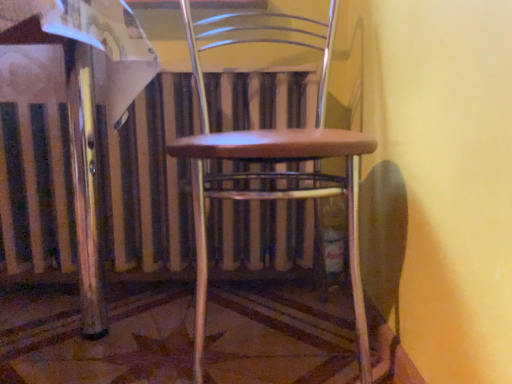
The image size is (512, 384). Identify the location of wooden seat at center. (272, 161).

This screenshot has height=384, width=512. Describe the element at coordinates (272, 161) in the screenshot. I see `wooden seat at center` at that location.

This screenshot has height=384, width=512. What do you see at coordinates (150, 181) in the screenshot?
I see `metallic silver radiator at center` at bounding box center [150, 181].

Find the location of a particular element. metallic silver radiator at center is located at coordinates tap(150, 181).

In order to face metallic silver radiator at center, should I rotate leftwards or rightwards?

You should look left and rotate roughly 10.817 degrees.

Locate an element on the screen. wooden seat at center is located at coordinates (272, 161).

Is wooden seat at center to the right of metallic silver radiator at center from the viewer's perspective?

Indeed, wooden seat at center is positioned on the right side of metallic silver radiator at center.

Between wooden seat at center and metallic silver radiator at center, which one is positioned behind?

metallic silver radiator at center is behind.

Between point (199, 235) and point (189, 88), which one is positioned in front?

Point (199, 235)

Looking at this image, from the image's perspective, does wooden seat at center appear higher than metallic silver radiator at center?

Yes, from the image's perspective, wooden seat at center is on top of metallic silver radiator at center.

From a real-world perspective, relative to metallic silver radiator at center, is wooden seat at center vertically above or below?

In terms of real-world spatial position, wooden seat at center is above metallic silver radiator at center.

Can you confirm if wooden seat at center is thinner than metallic silver radiator at center?

Incorrect, the width of wooden seat at center is not less than that of metallic silver radiator at center.

Between wooden seat at center and metallic silver radiator at center, which one has less height?

Standing shorter between the two is metallic silver radiator at center.

Can you confirm if wooden seat at center is smaller than metallic silver radiator at center?

Incorrect, wooden seat at center is not smaller in size than metallic silver radiator at center.

Can we say wooden seat at center lies outside metallic silver radiator at center?

Yes, wooden seat at center is outside of metallic silver radiator at center.

Is wooden seat at center beside metallic silver radiator at center?

No, wooden seat at center is not in contact with metallic silver radiator at center.

Could you tell me if wooden seat at center is turned towards metallic silver radiator at center?

No, wooden seat at center is not turned towards metallic silver radiator at center.

Can you tell me how much wooden seat at center and metallic silver radiator at center differ in facing direction?

There is a 0.386-degree angle between the facing directions of wooden seat at center and metallic silver radiator at center.

How distant is wooden seat at center from metallic silver radiator at center?

A distance of 8.94 inches exists between wooden seat at center and metallic silver radiator at center.

In order to click on chair that is in front of the metallic silver radiator at center in this screenshot , I will do `click(272, 161)`.

Visually, is metallic silver radiator at center positioned to the left or to the right of wooden seat at center?

Clearly, metallic silver radiator at center is on the left of wooden seat at center in the image.

Considering the positions of objects metallic silver radiator at center and wooden seat at center in the image provided, who is in front, metallic silver radiator at center or wooden seat at center?

wooden seat at center is more forward.

Which point is more distant from viewer, (16, 205) or (295, 135)?

Positioned behind is point (16, 205).

From the image's perspective, would you say metallic silver radiator at center is positioned over wooden seat at center?

No.

In the scene shown: From a real-world perspective, which object stands above the other?

wooden seat at center.

Looking at this image, considering the relative sizes of metallic silver radiator at center and wooden seat at center in the image provided, is metallic silver radiator at center wider than wooden seat at center?

In fact, metallic silver radiator at center might be narrower than wooden seat at center.

Is metallic silver radiator at center shorter than wooden seat at center?

Yes, metallic silver radiator at center is shorter than wooden seat at center.

Considering the sizes of metallic silver radiator at center and wooden seat at center in the image, is metallic silver radiator at center bigger or smaller than wooden seat at center?

In the image, metallic silver radiator at center appears to be smaller than wooden seat at center.

Is metallic silver radiator at center completely or partially outside of wooden seat at center?

metallic silver radiator at center lies outside wooden seat at center's area.

Does metallic silver radiator at center touch wooden seat at center?

They are not placed beside each other.

Is metallic silver radiator at center facing towards wooden seat at center?

Yes, metallic silver radiator at center faces towards wooden seat at center.

Identify the location of radiator behind the wooden seat at center. (150, 181).

Find the location of a particular element. The width and height of the screenshot is (512, 384). chair positioned vertically above the metallic silver radiator at center (from a real-world perspective) is located at coordinates (272, 161).

Find the location of a particular element. The height and width of the screenshot is (384, 512). chair above the metallic silver radiator at center (from the image's perspective) is located at coordinates (272, 161).